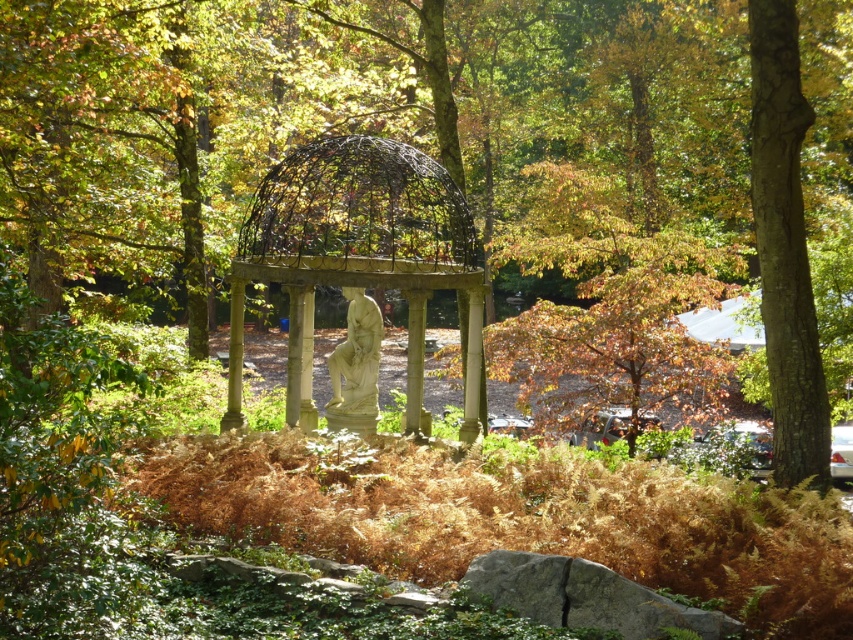
You are standing in the garden and want to take a photo of the matte black gazebo at center. If you are currently at position coordinates, where should you position yourself to ensure the gazebo is centered in your photo?

To center the matte black gazebo at center in your photo, you should position yourself directly in front of its coordinates at point (357, 253).

You are a gardener wanting to place a new decorative pot in this garden. The pot is 1 meter tall. You want to place it so that it doesn not block the view of the light beige stone statue at center. Where should you place the pot relative to the matte black gazebo at center?

The matte black gazebo at center is positioned over the light beige stone statue at center. To avoid blocking the view of the light beige stone statue at center, you should place the decorative pot either to the side or behind the matte black gazebo at center, ensuring it does not obstruct the line of sight to the statue beneath it.